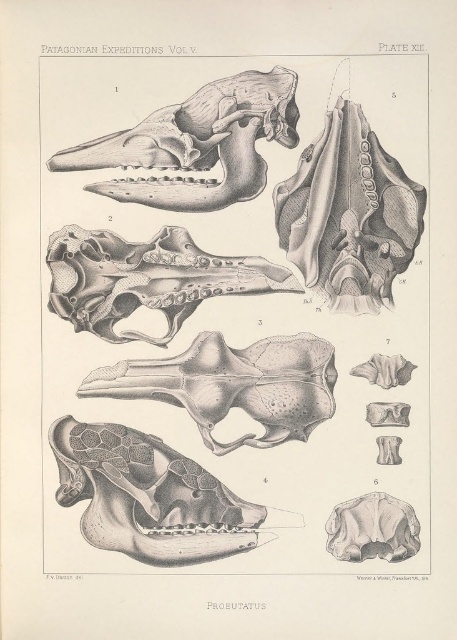
You are examining the illustration of the Proeutatus skull in Plate XIII. You notice two points labeled with coordinates in the image. From your vantage point, which of the two points, point (219, 156) or point (155, 340), appears closer to you?

Point (219, 156) is closer to the camera than point (155, 340), so it appears closer to you.

Looking at the illustration from Patagonian Expeditions Vol. V, Plate XIII, you notice two skulls labeled as smooth gray skull at lower left and gray bone skull at center. Which of these two skulls is positioned further to the left?

The smooth gray skull at lower left is positioned further to the left compared to the gray bone skull at center.